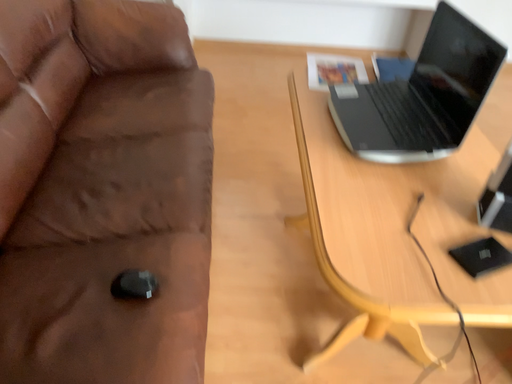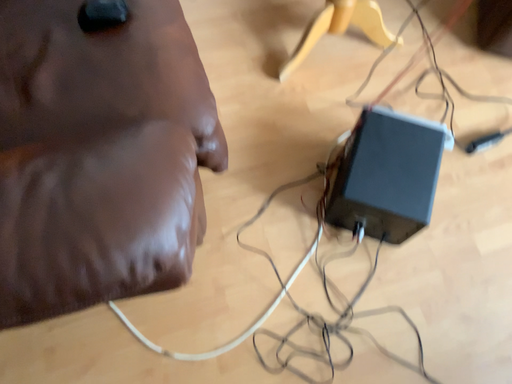
Question: How did the camera likely rotate when shooting the video?

Choices:
 (A) rotated right
 (B) rotated left

Answer: (A)